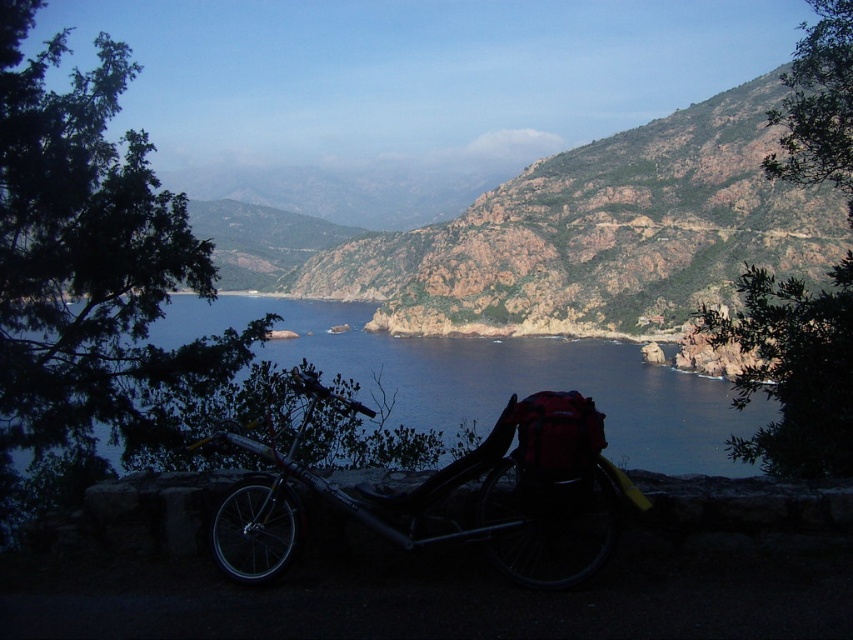
You are a hiker who wants to cross the blue water at center to reach the other side. The silver metallic mountain bike at lower center is in your way. Can you move the bike to the side to make a path?

The silver metallic mountain bike at lower center is positioned under blue water at center, so it is already submerged in the water. Moving it might be difficult due to the water current or depth, but since the bike is under the water, you can swim around it to cross the blue water at center.

Consider the image. You are a hiker planning to descend from the rustic rock cliff at center to the blue water at center. Based on the scene, what direction should you head relative to the cliff and water to reach the water safely?

The rustic rock cliff at center is above the blue water at center, so to descend safely, you should head downward towards the blue water at center from the rustic rock cliff at center.

You are standing at the point marked as point [450,492] in the image. What object is located exactly at that point?

The silver metallic mountain bike at lower center is located exactly at point [450,492].